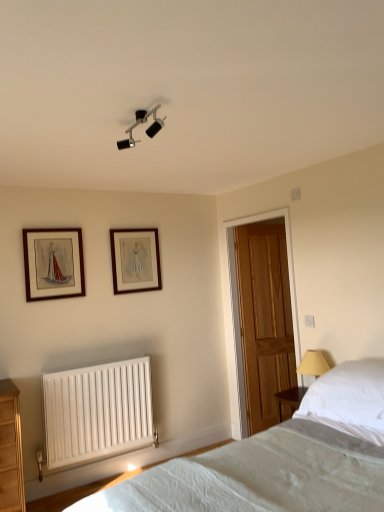
I want to click on free space below matte black light fixture at upper center (from a real-world perspective), so point(175,464).